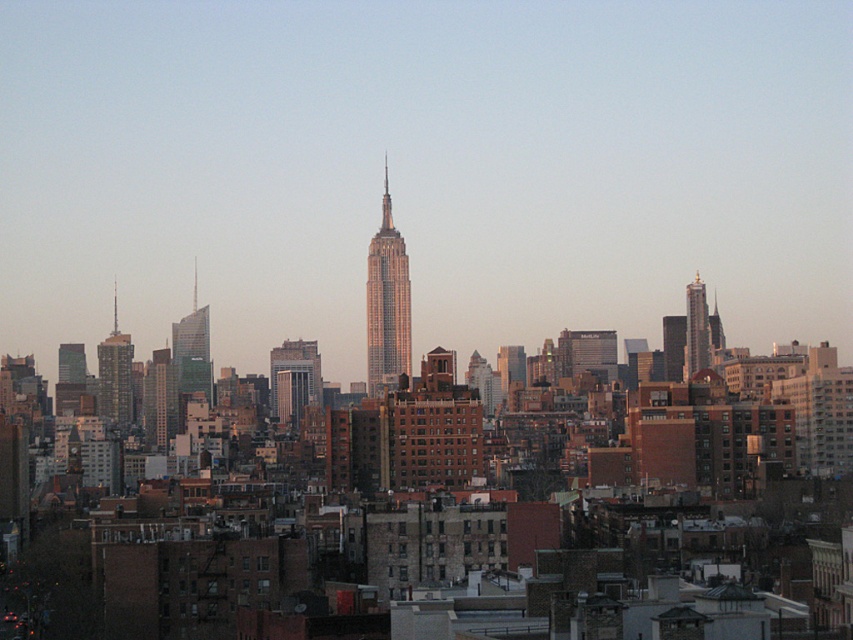
Is shiny glass skyscraper at center taller than green glass skyscraper at left?

Yes.

Which is behind, point (376, 292) or point (209, 378)?

Point (209, 378)

Does point (375, 305) come farther from viewer compared to point (171, 326)?

No.

The height and width of the screenshot is (640, 853). In order to click on shiny glass skyscraper at center in this screenshot , I will do `click(387, 301)`.

Does shiny glass skyscraper at center appear on the right side of gold reflective skyscraper at right?

Incorrect, shiny glass skyscraper at center is not on the right side of gold reflective skyscraper at right.

Does shiny glass skyscraper at center have a larger size compared to gold reflective skyscraper at right?

Yes, shiny glass skyscraper at center is bigger than gold reflective skyscraper at right.

Identify the location of shiny glass skyscraper at center. This screenshot has width=853, height=640. (387, 301).

This screenshot has width=853, height=640. I want to click on shiny glass skyscraper at center, so click(x=387, y=301).

Which is above, shiny glass skyscraper at center or metallic glass skyscraper at left?

shiny glass skyscraper at center

In the scene shown: Who is lower down, shiny glass skyscraper at center or metallic glass skyscraper at left?

metallic glass skyscraper at left is lower down.

Is point (405, 369) in front of point (114, 305)?

Yes, point (405, 369) is closer to viewer.

The height and width of the screenshot is (640, 853). I want to click on shiny glass skyscraper at center, so click(x=387, y=301).